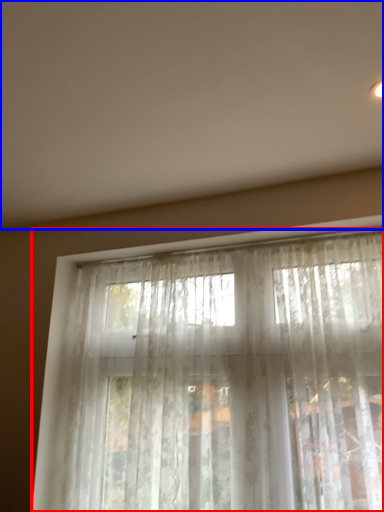
Question: Which point is closer to the camera, curtain (highlighted by a red box) or backdrop (highlighted by a blue box)?

Choices:
 (A) curtain
 (B) backdrop

Answer: (B)